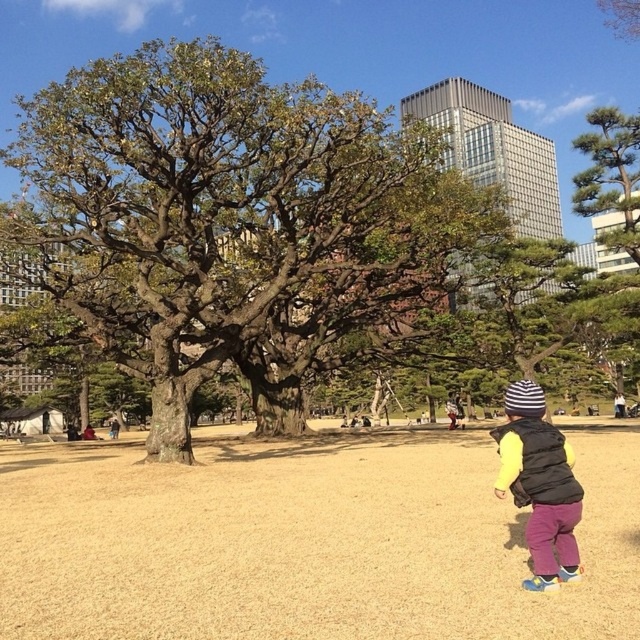
The image size is (640, 640). I want to click on brown dry grass at center, so click(x=305, y=541).

I want to click on brown dry grass at center, so click(x=305, y=541).

Does striped knit hat at lower right have a greater width compared to green textured pine tree at upper right?

No, striped knit hat at lower right is not wider than green textured pine tree at upper right.

Which is more to the right, striped knit hat at lower right or green textured pine tree at upper right?

Positioned to the right is green textured pine tree at upper right.

The image size is (640, 640). Describe the element at coordinates (540, 484) in the screenshot. I see `striped knit hat at lower right` at that location.

You are a GUI agent. You are given a task and a screenshot of the screen. Output one action in this format:
    pyautogui.click(x=<x>, y=<y>)
    Task: Click on the striped knit hat at lower right
    
    Given the screenshot: What is the action you would take?
    pyautogui.click(x=540, y=484)

Is brown textured oak tree at center thinner than striped knit hat at lower right?

No.

Does brown textured oak tree at center appear on the left side of striped knit hat at lower right?

Yes, brown textured oak tree at center is to the left of striped knit hat at lower right.

Where is `brown textured oak tree at center`? This screenshot has width=640, height=640. brown textured oak tree at center is located at coordinates (236, 225).